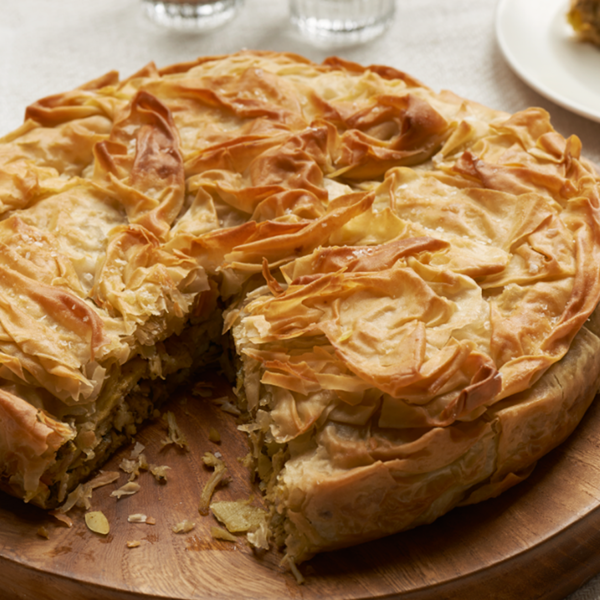
The height and width of the screenshot is (600, 600). What are the coordinates of `plate` in the screenshot? It's located at (566, 55).